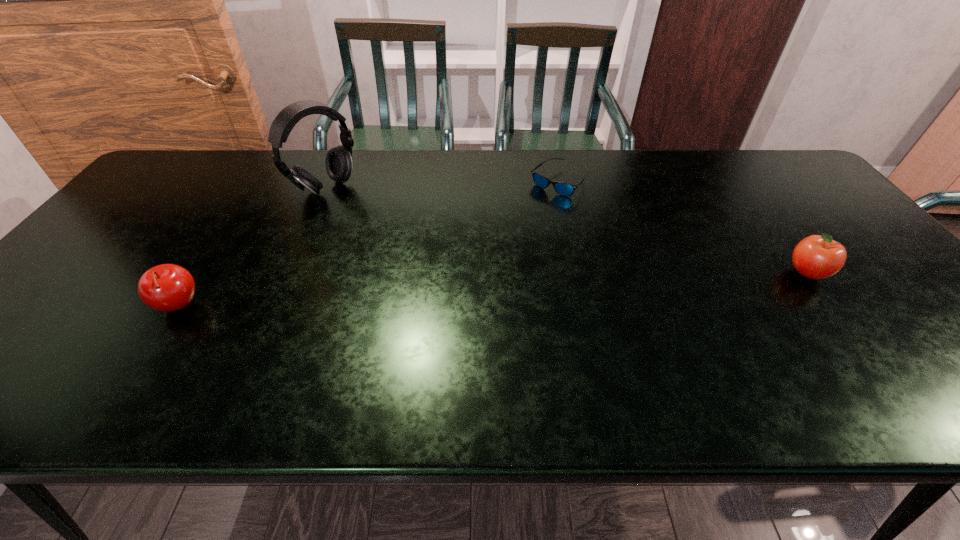
Locate an element on the screen. This screenshot has height=540, width=960. vacant space on the desktop that is between the leftmost object and the rightmost object and is positioned at the front of the shortest object showing the lenses is located at coordinates (584, 285).

The width and height of the screenshot is (960, 540). I want to click on free space on the desktop that is between the cherry and the apple and is positioned on the ear cups of the third object from right to left, so click(481, 290).